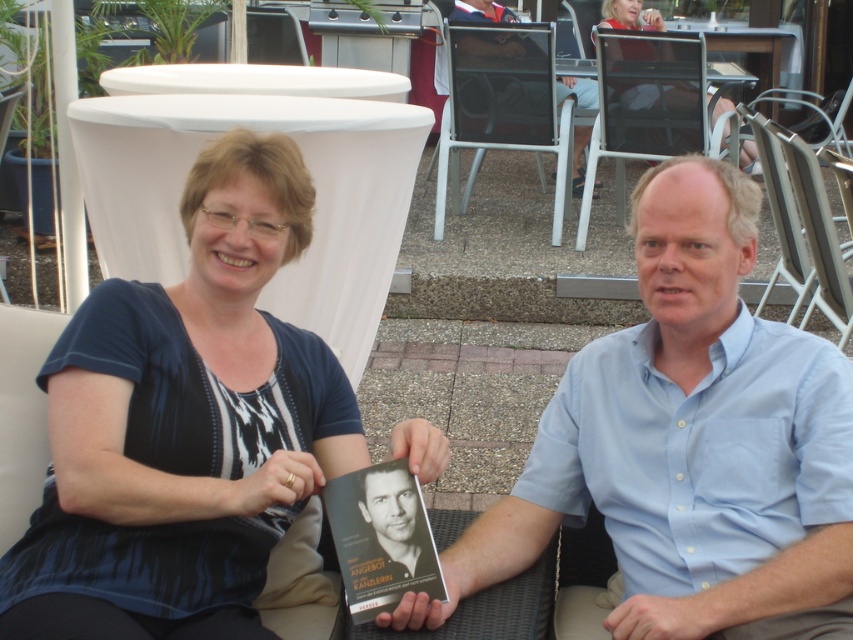
Question: Is the position of light blue shirt at center more distant than that of hardcover book at center?

Choices:
 (A) yes
 (B) no

Answer: (B)

Question: Which of these objects is positioned closest to the light blue shirt at center?

Choices:
 (A) hardcover book at center
 (B) matte black dress at upper center

Answer: (A)

Question: Where is light blue shirt at center located in relation to hardcover book at center in the image?

Choices:
 (A) right
 (B) left

Answer: (A)

Question: Is hardcover book at center in front of light blue shirt at upper right?

Choices:
 (A) no
 (B) yes

Answer: (B)

Question: Which object appears closest to the camera in this image?

Choices:
 (A) hardcover book at center
 (B) matte black dress at upper center
 (C) light blue shirt at upper right

Answer: (A)

Question: Among these objects, which one is farthest from the camera?

Choices:
 (A) matte black dress at upper center
 (B) light blue shirt at center
 (C) hardcover book at center
 (D) blue fabric shirt at upper left

Answer: (A)